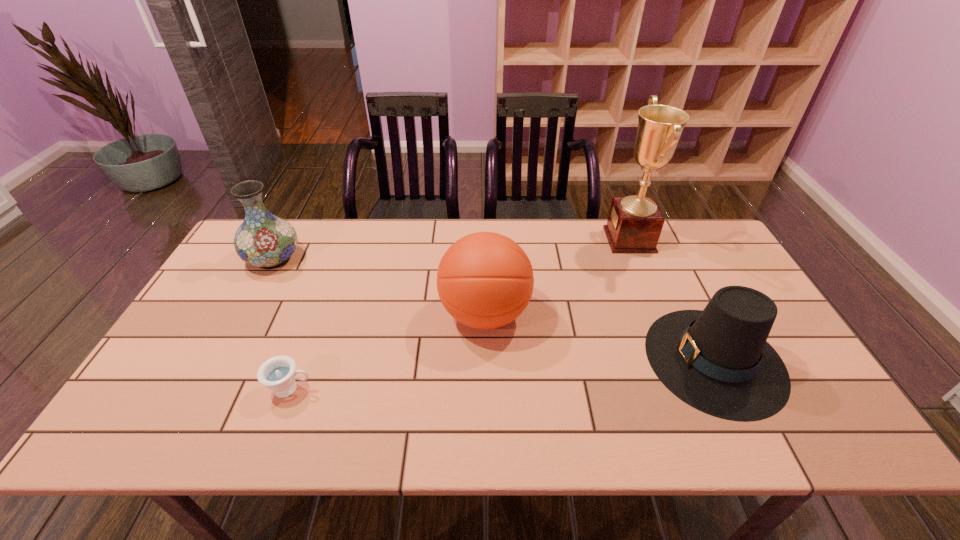
This screenshot has width=960, height=540. Identify the location of object situated at the far left corner. (267, 241).

This screenshot has width=960, height=540. I want to click on object present at the near right corner, so click(x=718, y=361).

Identify the location of free location at the far edge. This screenshot has height=540, width=960. (357, 259).

Identify the location of free location at the near edge of the desktop. Image resolution: width=960 pixels, height=540 pixels. (644, 418).

The width and height of the screenshot is (960, 540). Identify the location of free location at the left edge of the desktop. (243, 327).

In the image, there is a desktop. What are the coordinates of `vacant area at the right edge` in the screenshot? It's located at (798, 360).

Find the location of `free space that is in between the trophy cup and the basketball`. free space that is in between the trophy cup and the basketball is located at coordinates (557, 277).

Find the location of a particular element. Image resolution: width=960 pixels, height=540 pixels. free space between the trophy cup and the basketball is located at coordinates (557, 277).

I want to click on free space that is in between the shortest object and the fourth tallest object, so click(x=503, y=374).

In order to click on vacant area that lies between the tallest object and the third object from left to right in this screenshot , I will do `click(557, 277)`.